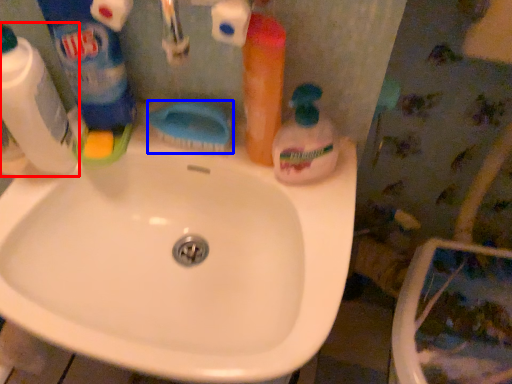
Question: Which of the following is the farthest to the observer, cleaning product (highlighted by a red box) or brush (highlighted by a blue box)?

Choices:
 (A) cleaning product
 (B) brush

Answer: (B)